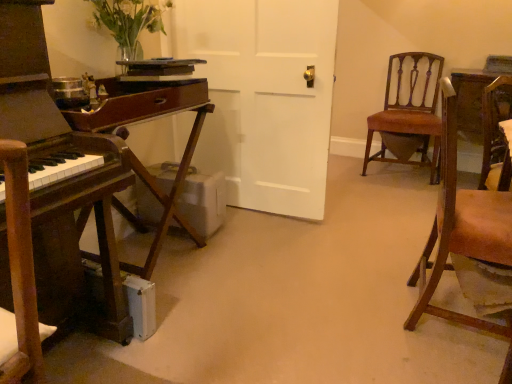
Find the location of a particular element. This screenshot has width=512, height=384. vacant space to the right of brown wooden desk at left is located at coordinates (184, 352).